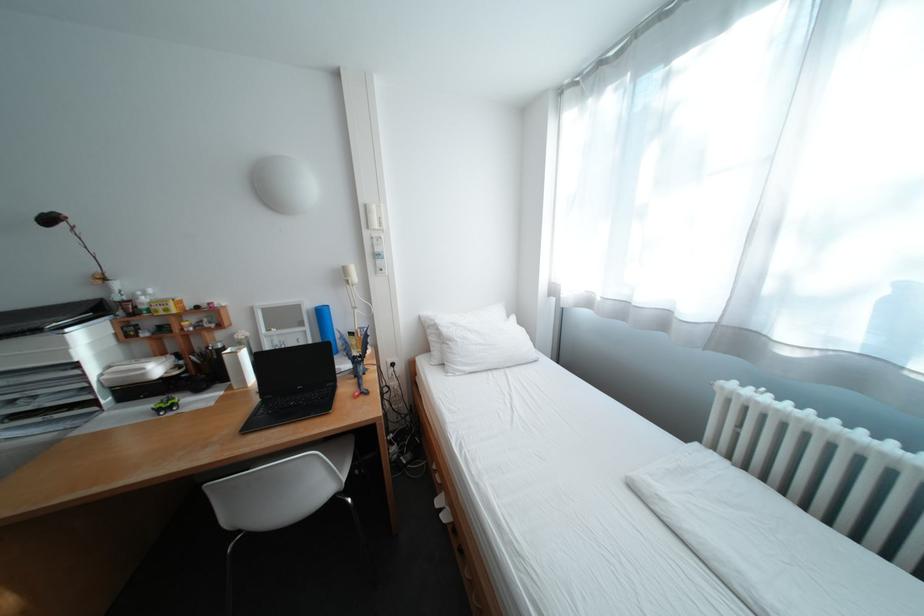
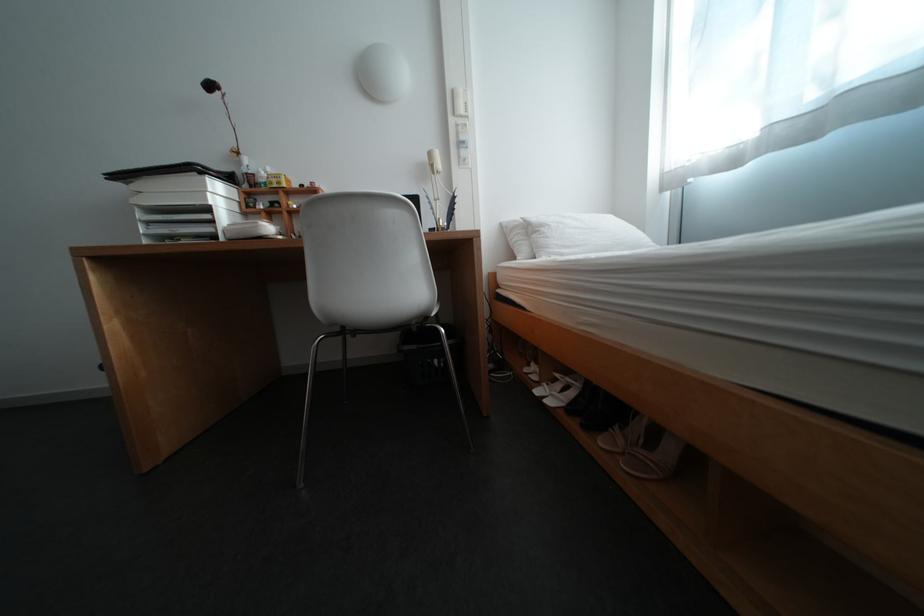
Find the pixel in the second image that matches the point at 156,370 in the first image.

(270, 224)